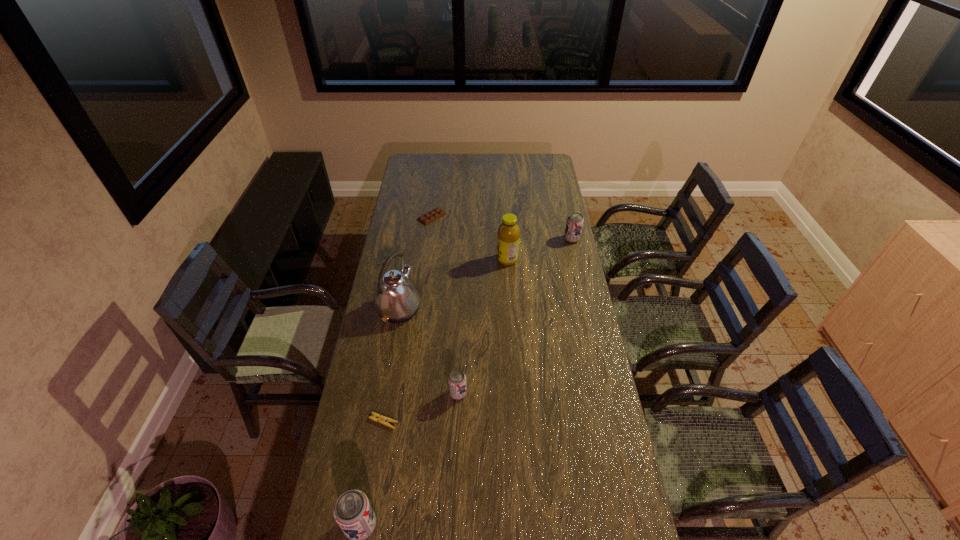
This screenshot has width=960, height=540. I want to click on vacant region that satisfies the following two spatial constraints: 1. on the front side of the chocolate bar; 2. on the right side of the second shortest beer can, so click(x=429, y=239).